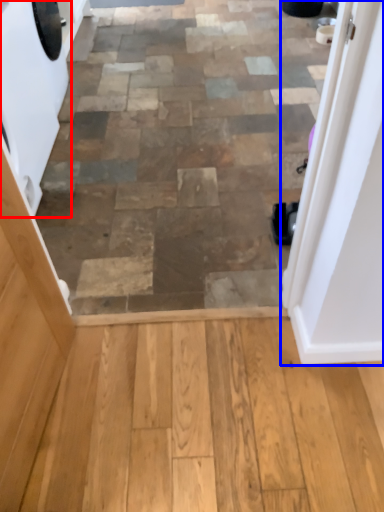
Question: Which object is further to the camera taking this photo, washing machine (highlighted by a red box) or door (highlighted by a blue box)?

Choices:
 (A) washing machine
 (B) door

Answer: (A)